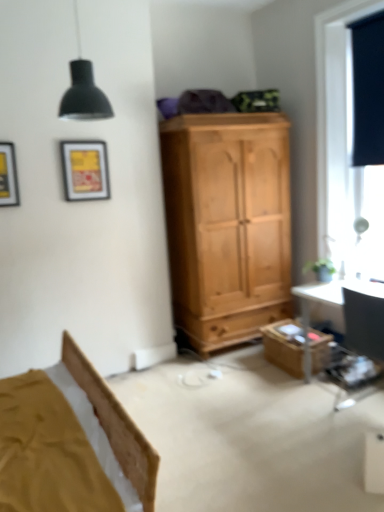
Question: From the image's perspective, would you say matte yellow picture frame at upper left, the 1th picture frame viewed from the back, is shown under black matte curtain at upper right?

Choices:
 (A) yes
 (B) no

Answer: (A)

Question: Can you confirm if matte yellow picture frame at upper left, marked as the second picture frame in a front-to-back arrangement, is smaller than black matte curtain at upper right?

Choices:
 (A) yes
 (B) no

Answer: (A)

Question: Considering the relative positions of matte yellow picture frame at upper left, marked as the second picture frame in a front-to-back arrangement, and black matte curtain at upper right in the image provided, is matte yellow picture frame at upper left, marked as the second picture frame in a front-to-back arrangement, to the right of black matte curtain at upper right from the viewer's perspective?

Choices:
 (A) yes
 (B) no

Answer: (B)

Question: Does matte yellow picture frame at upper left, marked as the second picture frame in a front-to-back arrangement, touch black matte curtain at upper right?

Choices:
 (A) no
 (B) yes

Answer: (A)

Question: Is matte yellow picture frame at upper left, placed as the 1th picture frame when sorted from right to left, further to camera compared to black matte curtain at upper right?

Choices:
 (A) no
 (B) yes

Answer: (B)

Question: Would you consider matte yellow picture frame at upper left, marked as the second picture frame in a front-to-back arrangement, to be distant from black matte curtain at upper right?

Choices:
 (A) yes
 (B) no

Answer: (A)

Question: Considering the relative sizes of black fabric window at right and black matte curtain at upper right in the image provided, is black fabric window at right shorter than black matte curtain at upper right?

Choices:
 (A) no
 (B) yes

Answer: (A)

Question: Is black fabric window at right behind black matte curtain at upper right?

Choices:
 (A) no
 (B) yes

Answer: (A)

Question: Is black matte curtain at upper right surrounded by black fabric window at right?

Choices:
 (A) no
 (B) yes

Answer: (B)

Question: From a real-world perspective, is black fabric window at right physically above black matte curtain at upper right?

Choices:
 (A) yes
 (B) no

Answer: (B)

Question: Does black fabric window at right lie in front of black matte curtain at upper right?

Choices:
 (A) yes
 (B) no

Answer: (A)

Question: Does black fabric window at right have a greater height compared to black matte curtain at upper right?

Choices:
 (A) yes
 (B) no

Answer: (A)

Question: Considering the relative positions of matte yellow picture frame at upper left, marked as the second picture frame in a front-to-back arrangement, and matte yellow picture frame at upper left, arranged as the second picture frame when viewed from the right, in the image provided, is matte yellow picture frame at upper left, marked as the second picture frame in a front-to-back arrangement, in front of matte yellow picture frame at upper left, arranged as the second picture frame when viewed from the right,?

Choices:
 (A) no
 (B) yes

Answer: (A)